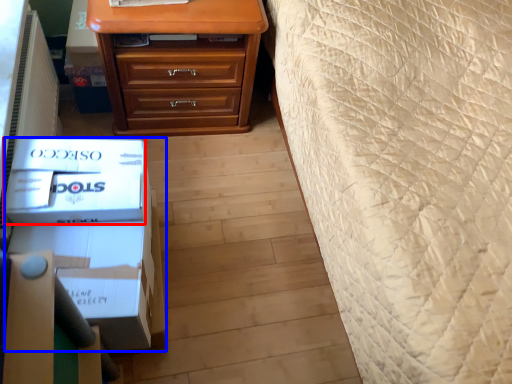
Question: Among these objects, which one is farthest to the camera, box (highlighted by a red box) or box (highlighted by a blue box)?

Choices:
 (A) box
 (B) box

Answer: (A)